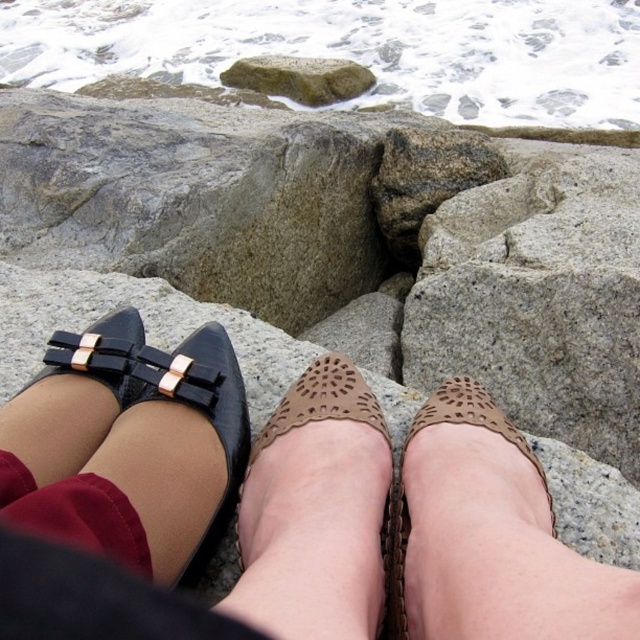
Question: Which point appears farthest from the camera in this image?

Choices:
 (A) (285, 61)
 (B) (557, 579)

Answer: (A)

Question: Considering the relative positions of black leather shoes at lower left and gray rough rock at upper center in the image provided, where is black leather shoes at lower left located with respect to gray rough rock at upper center?

Choices:
 (A) below
 (B) above

Answer: (A)

Question: Which object appears farthest from the camera in this image?

Choices:
 (A) brown leather shoe at center
 (B) black leather shoes at lower left

Answer: (A)

Question: Does brown leather shoe at center appear on the left side of red cotton sock at lower left?

Choices:
 (A) yes
 (B) no

Answer: (B)

Question: Estimate the real-world distances between objects in this image. Which object is closer to the brown leather shoe at center?

Choices:
 (A) black leather flat at left
 (B) brown perforated shoe at center
 (C) black leather shoes at lower left

Answer: (C)

Question: Where is black leather flat at left located in relation to red cotton sock at lower left in the image?

Choices:
 (A) below
 (B) above

Answer: (B)